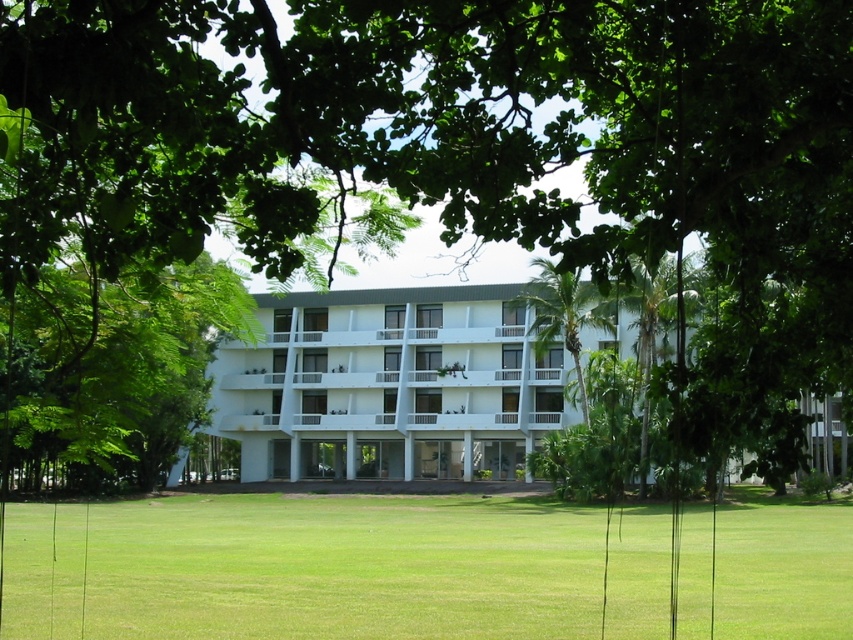
You are a guest at the hotel and want to take a photo of the white glossy building at center and the green leafy tree at center from the lawn. Which object should you focus on first if you want to capture both in the same frame without moving the camera?

The white glossy building at center is below the green leafy tree at center, so you should focus on the green leafy tree at center first to ensure both are in the frame.

You are standing in front of the white glossy building at center and the green leafy tree at center. Which object is located to the left?

The green leafy tree at center is located to the left of the white glossy building at center.

Based on the scene described, which object is positioned to the right when observing the white glossy building at center and the green leafy palm tree at center?

The white glossy building at center is positioned to the right of the green leafy palm tree at center.